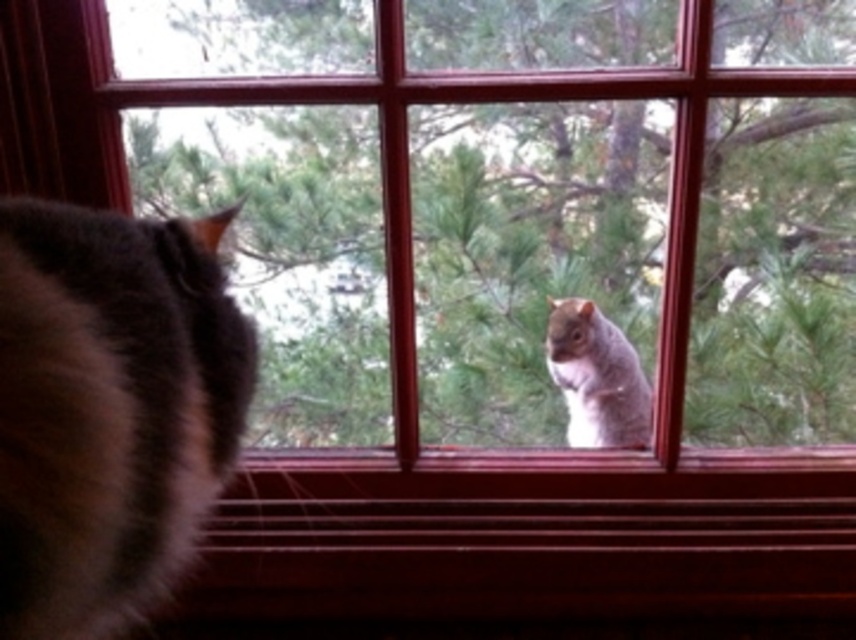
In the scene shown: Can you confirm if brown fluffy cat at left is positioned to the left of gray furry squirrel at upper center?

Indeed, brown fluffy cat at left is positioned on the left side of gray furry squirrel at upper center.

Is point (28, 531) behind point (599, 358)?

That is False.

What are the coordinates of `brown fluffy cat at left` in the screenshot? It's located at (110, 410).

Image resolution: width=856 pixels, height=640 pixels. I want to click on brown fluffy cat at left, so click(110, 410).

Who is positioned more to the right, green leafy tree at center or brown fluffy cat at left?

From the viewer's perspective, green leafy tree at center appears more on the right side.

Measure the distance between point [488,237] and camera.

Point [488,237] and camera are 6.19 feet apart.

Locate an element on the screen. Image resolution: width=856 pixels, height=640 pixels. green leafy tree at center is located at coordinates (514, 202).

Can you confirm if green leafy tree at center is positioned to the right of gray furry squirrel at upper center?

In fact, green leafy tree at center is to the left of gray furry squirrel at upper center.

Where is `green leafy tree at center`? This screenshot has width=856, height=640. green leafy tree at center is located at coordinates (514, 202).

I want to click on green leafy tree at center, so [x=514, y=202].